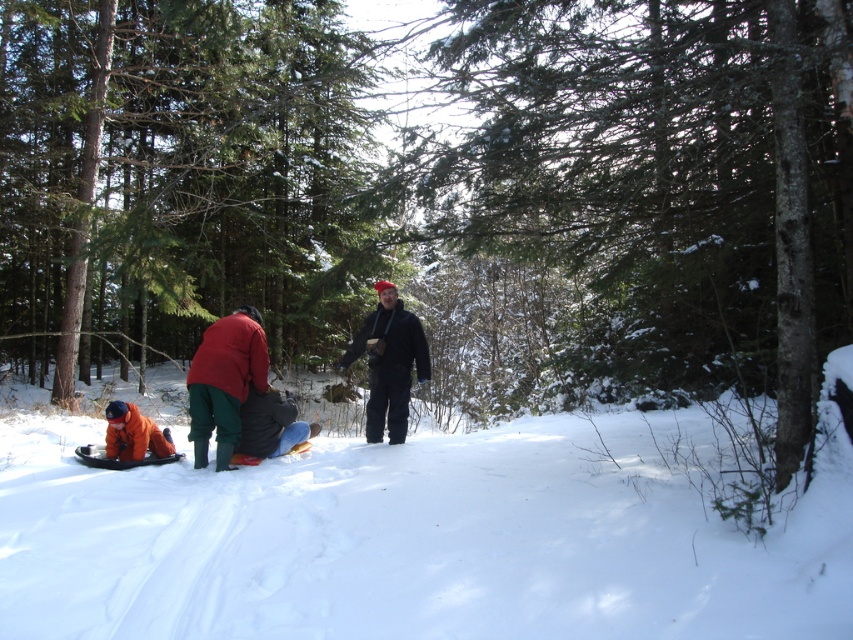
You are standing at the point labeled point (349, 564) in a snowy forest. You want to throw a snowball to someone exactly 6 meters away from you. Is the viewer within range?

The distance between point (349, 564) and the viewer is 5.32 meters, which is less than 6 meters. Therefore, the viewer is within range.

You are standing in the snowy forest scene. There is white fluffy snow at center and a matte black jacket at center. Which object is closer to you?

The white fluffy snow at center is closer to the viewer than the matte black jacket at center.